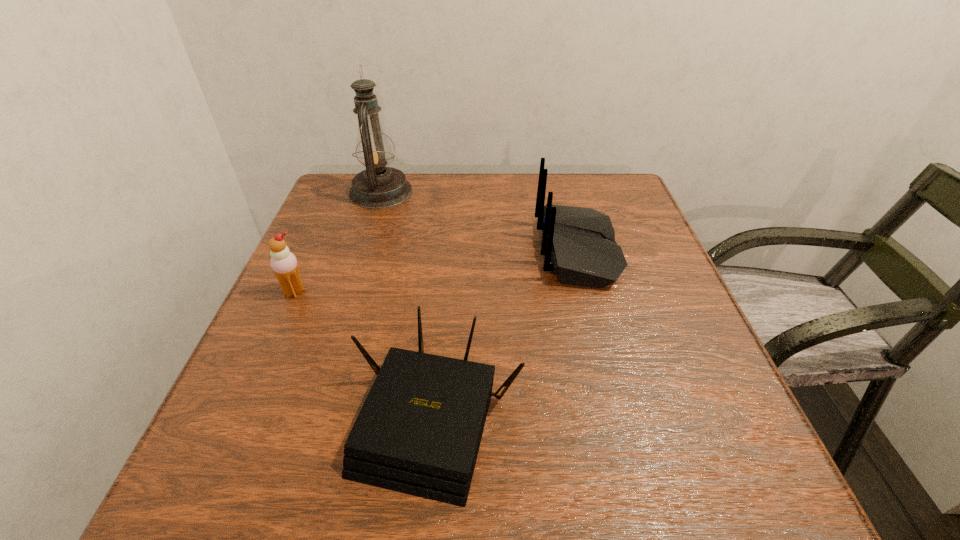
At what (x,y) coordinates should I click in order to perform the action: click on the farthest object. Please return your answer as a coordinate pair (x, y). The height and width of the screenshot is (540, 960). Looking at the image, I should click on (377, 187).

What are the coordinates of `oil lamp` in the screenshot? It's located at (377, 187).

You are a GUI agent. You are given a task and a screenshot of the screen. Output one action in this format:
    pyautogui.click(x=<x>, y=<y>)
    Task: Click on the taller router
    This screenshot has width=960, height=540.
    Given the screenshot: What is the action you would take?
    pyautogui.click(x=579, y=245)

The height and width of the screenshot is (540, 960). What are the coordinates of `the farther router` in the screenshot? It's located at click(579, 245).

The image size is (960, 540). What are the coordinates of `the third tallest object` in the screenshot? It's located at (284, 264).

Find the location of a particular element. icecream is located at coordinates (284, 264).

Where is `the nearest object`? The image size is (960, 540). the nearest object is located at coordinates (419, 430).

Where is `the nearer router`? the nearer router is located at coordinates pyautogui.click(x=419, y=430).

What are the coordinates of `free point located on the front of the farthest object` in the screenshot? It's located at (338, 326).

I want to click on free space located 0.290m on the back of the taller router, so click(x=411, y=251).